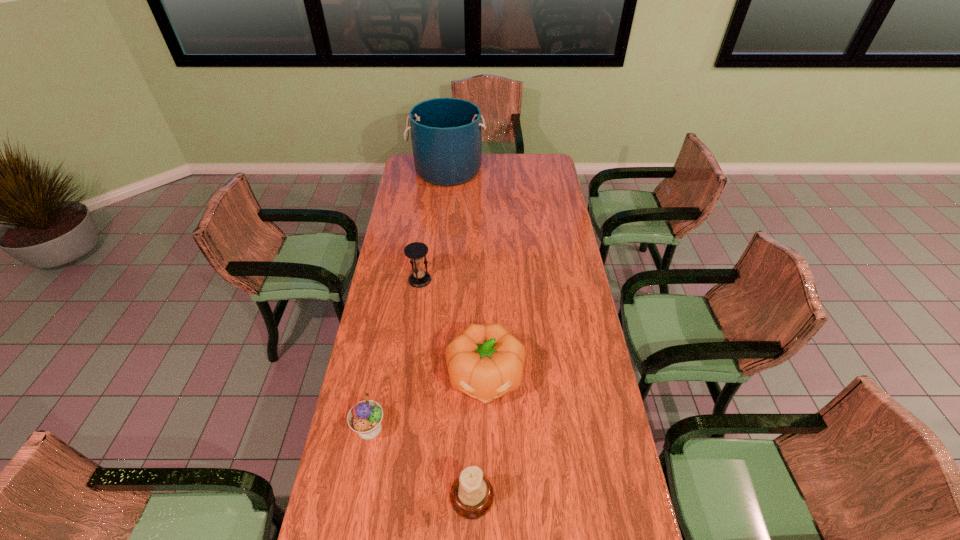
This screenshot has height=540, width=960. What are the coordinates of `the closest object to the second farthest object` in the screenshot? It's located at (485, 361).

Point out which object is positioned as the third nearest to the bucket. Please provide its 2D coordinates. Your answer should be formatted as a tuple, i.e. [(x, y)], where the tuple contains the x and y coordinates of a point satisfying the conditions above.

[(365, 417)]

Locate an element on the screen. The height and width of the screenshot is (540, 960). free location that satisfies the following two spatial constraints: 1. on the front side of the candle holder; 2. on the right side of the tallest object is located at coordinates (416, 496).

At what (x,y) coordinates should I click in order to perform the action: click on vacant region that satisfies the following two spatial constraints: 1. on the front side of the icecream; 2. on the left side of the candle holder. Please return your answer as a coordinate pair (x, y). The height and width of the screenshot is (540, 960). Looking at the image, I should click on (357, 496).

Where is `free point that satisfies the following two spatial constraints: 1. on the front side of the nearest object; 2. on the right side of the shortest object`? free point that satisfies the following two spatial constraints: 1. on the front side of the nearest object; 2. on the right side of the shortest object is located at coordinates (357, 496).